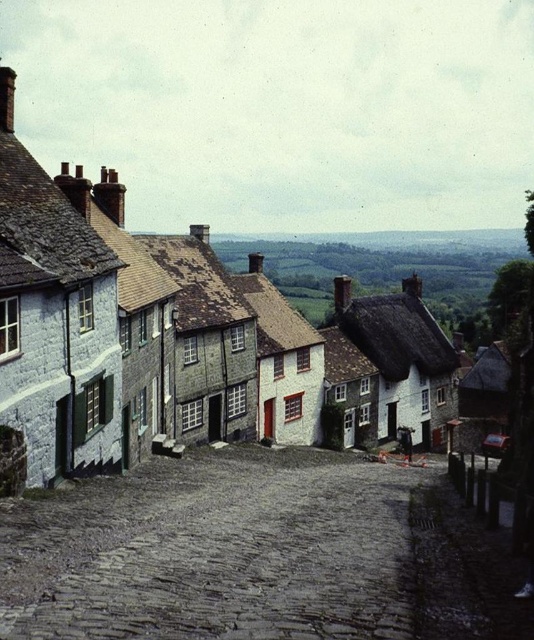
You are standing at the entrance of the gray cobblestone alley at center. If you walk straight ahead, will you be going uphill or downhill?

The gray cobblestone alley at center is positioned at point (256, 556), which indicates it slopes downhill in the direction of travel.

You are standing at the top of the village street and want to walk down to the gray cobblestone alley at center and the white stone houses at center. According to the scene description, which one is on the right side when facing downhill?

The gray cobblestone alley at center is positioned on the right side of white stone houses at center, so when facing downhill, the gray cobblestone alley at center is on the right side.